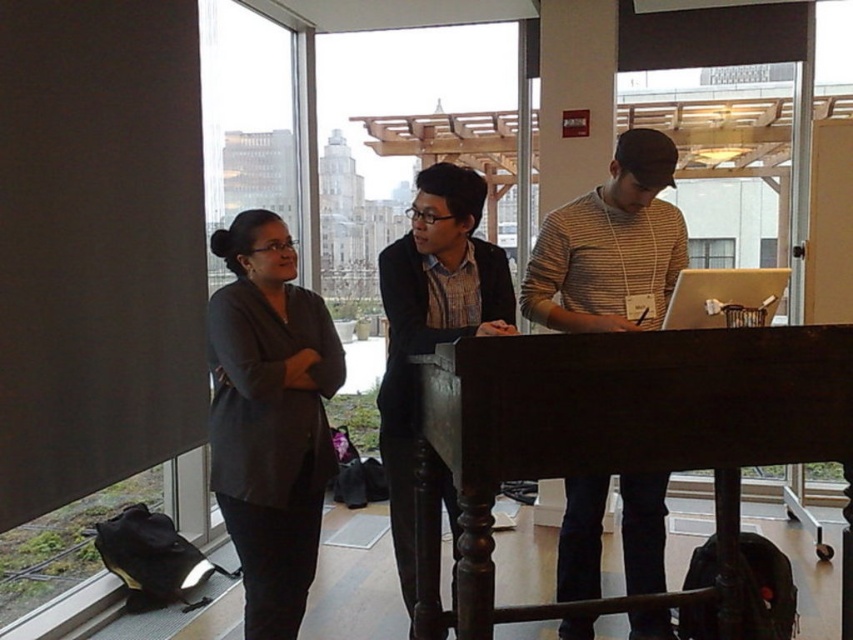
Question: Which object is closer to the camera taking this photo?

Choices:
 (A) striped sweater at center
 (B) matte black laptop at center
 (C) dark wood balustrade at center
 (D) matte black shirt at center

Answer: (C)

Question: Does matte black shirt at center have a smaller size compared to matte black laptop at center?

Choices:
 (A) yes
 (B) no

Answer: (B)

Question: Among these objects, which one is farthest from the camera?

Choices:
 (A) dark wood balustrade at center
 (B) matte black laptop at center
 (C) striped sweater at center

Answer: (C)

Question: Which object appears farthest from the camera in this image?

Choices:
 (A) dark wood balustrade at center
 (B) striped sweater at center
 (C) dark gray blazer at left

Answer: (B)

Question: Does matte black shirt at center have a smaller size compared to matte black laptop at center?

Choices:
 (A) no
 (B) yes

Answer: (A)

Question: Is dark wood balustrade at center in front of dark gray blazer at left?

Choices:
 (A) no
 (B) yes

Answer: (B)